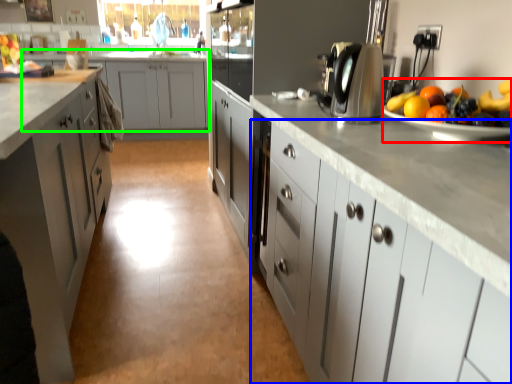
Question: Considering the real-world distances, which object is farthest from fruit salad (highlighted by a red box)? cabinetry (highlighted by a blue box) or cabinetry (highlighted by a green box)?

Choices:
 (A) cabinetry
 (B) cabinetry

Answer: (B)